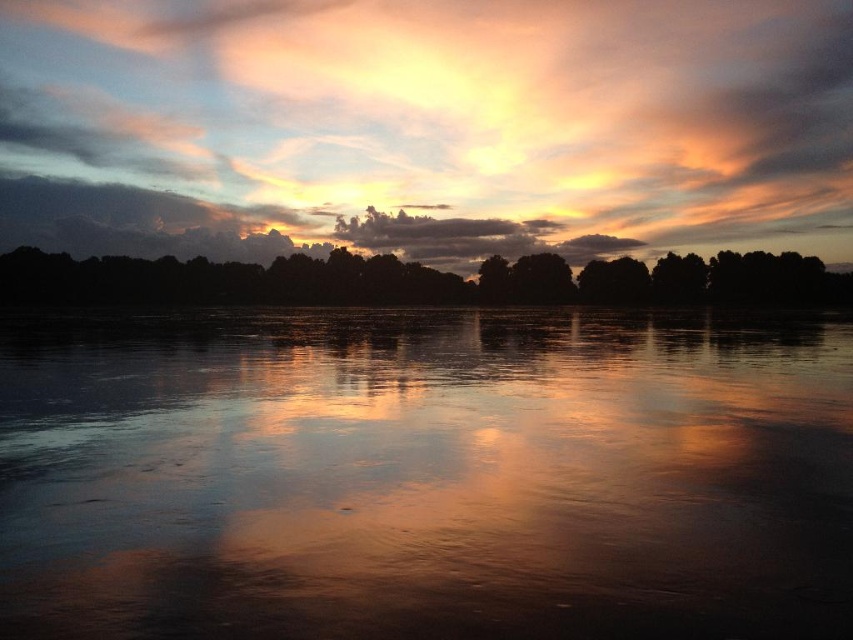
You are observing the sunset scene and want to take a photo. The camera is focused on the silhouette trees at center. Will the cloudy sky at upper center be in focus as well?

The silhouette trees at center is closer to the viewer than cloudy sky at upper center. Since the camera is focused on the silhouette trees at center, the cloudy sky at upper center will be out of focus because it is further away.

You are a drone operator who needs to fly a drone from the smooth reflective water at center to the cloudy sky at upper center. What is the approximate distance you need to cover in feet?

The distance between the smooth reflective water at center and the cloudy sky at upper center is 661.80 feet, so the drone operator needs to cover approximately 661.80 feet.